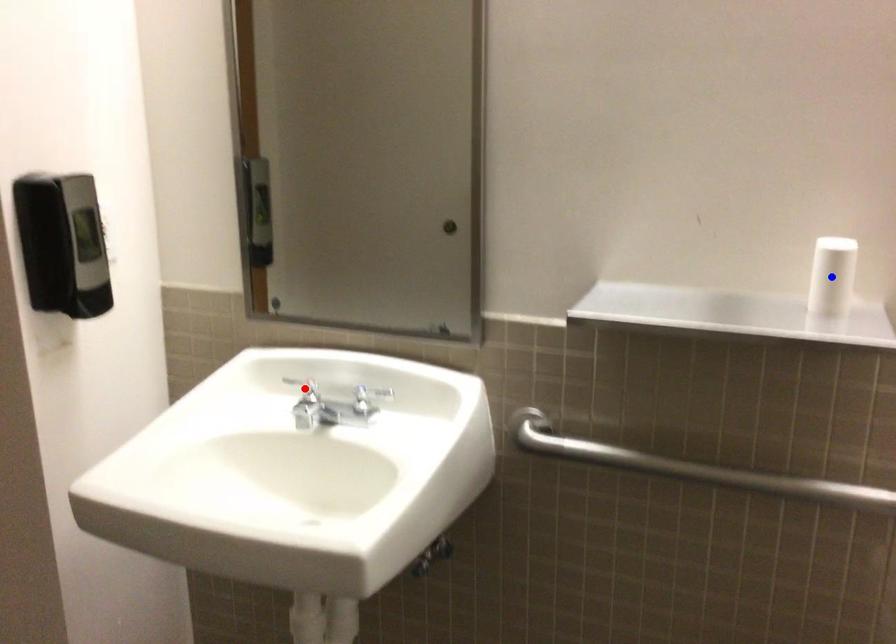
Question: In the image, two points are highlighted. Which point is nearer to the camera? Reply with the corresponding letter.

Choices:
 (A) blue point
 (B) red point

Answer: (A)